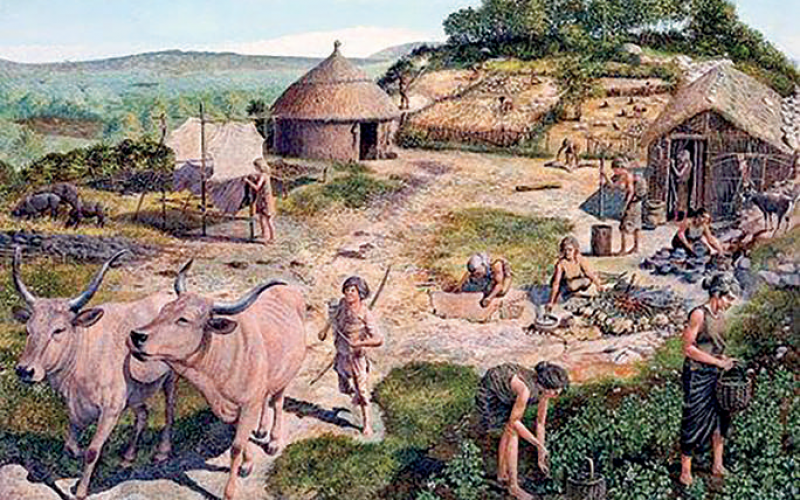
Find the location of a particular element. This screenshot has width=800, height=500. basket is located at coordinates (730, 399).